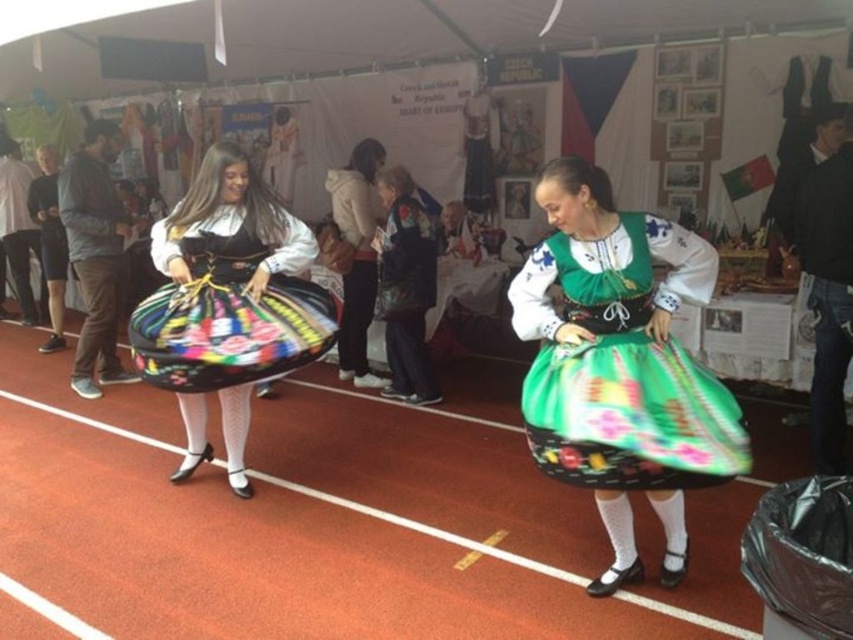
You are standing in the center of the tent and want to reach the point marked at coordinates (624,364). Which object is this point located on?

The point marked at coordinates (624,364) is located on the green satin dress at center.

You are organizing a fashion show and need to ensure that the green satin dress at center and the white cotton hoodie at center can fit side by side on a 1.2 meter wide mannequin stand. Based on their sizes, will they both fit comfortably?

The green satin dress at center is wider than the white cotton hoodie at center. Together, their combined width may exceed the 1.2 meter stand, so they might not fit comfortably side by side.